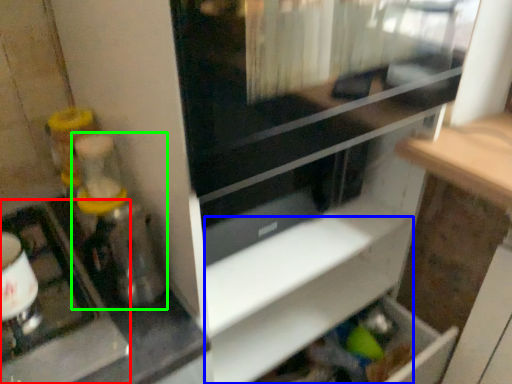
Question: Estimate the real-world distances between objects in this image. Which object is farther from appliance (highlighted by a red box), shelf (highlighted by a blue box) or blender (highlighted by a green box)?

Choices:
 (A) shelf
 (B) blender

Answer: (A)